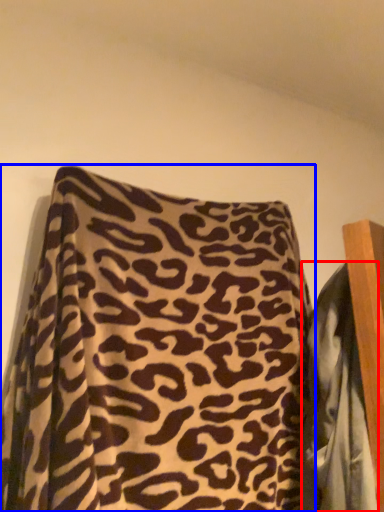
Question: Which of the following is the closest to the observer, blanket (highlighted by a red box) or pillow (highlighted by a blue box)?

Choices:
 (A) blanket
 (B) pillow

Answer: (B)